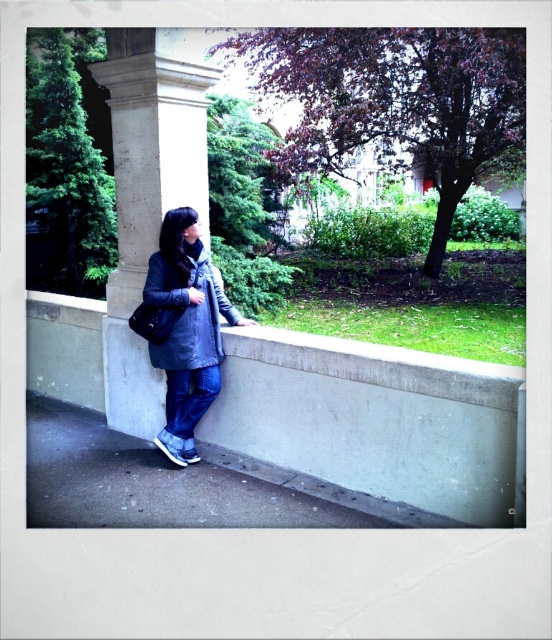
Question: Observing the image, what is the correct spatial positioning of concrete ledge at center in reference to dark gray textured coat at center?

Choices:
 (A) below
 (B) above

Answer: (A)

Question: Which object is the closest to the matte gray concrete wall at center?

Choices:
 (A) dark gray textured coat at center
 (B) smooth concrete pillar at center

Answer: (B)

Question: Estimate the real-world distances between objects in this image. Which object is closer to the smooth concrete pillar at center?

Choices:
 (A) concrete ledge at center
 (B) dark gray textured coat at center
 (C) matte gray concrete wall at center
 (D) denim jacket at center

Answer: (C)

Question: Among these objects, which one is farthest from the camera?

Choices:
 (A) dark gray textured coat at center
 (B) denim jacket at center
 (C) matte gray concrete wall at center

Answer: (C)

Question: Is matte gray concrete wall at center closer to the viewer compared to denim jacket at center?

Choices:
 (A) yes
 (B) no

Answer: (B)

Question: Can you confirm if matte gray concrete wall at center is thinner than dark gray textured coat at center?

Choices:
 (A) no
 (B) yes

Answer: (A)